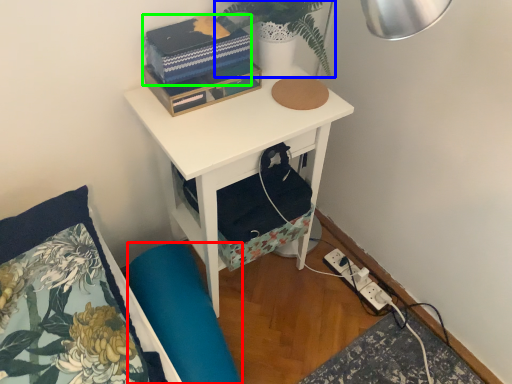
Question: Which object is positioned farthest from swivel chair (highlighted by a red box)? Select from plant (highlighted by a blue box) and book (highlighted by a green box).

Choices:
 (A) plant
 (B) book

Answer: (A)